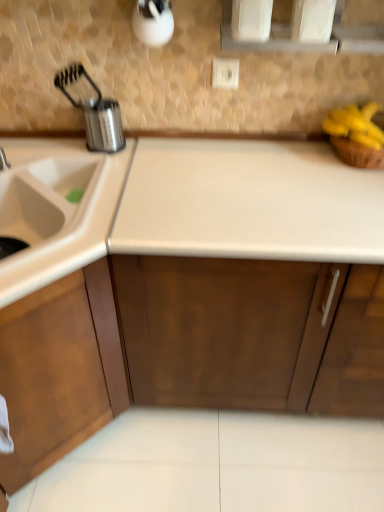
Question: Is wooden cabinet at left not within brushed metal faucet at left?

Choices:
 (A) no
 (B) yes

Answer: (B)

Question: Can you confirm if wooden cabinet at left is wider than brushed metal faucet at left?

Choices:
 (A) no
 (B) yes

Answer: (B)

Question: Considering the relative positions of wooden cabinet at left and brushed metal faucet at left in the image provided, is wooden cabinet at left behind brushed metal faucet at left?

Choices:
 (A) yes
 (B) no

Answer: (B)

Question: Is wooden cabinet at left far from brushed metal faucet at left?

Choices:
 (A) no
 (B) yes

Answer: (A)

Question: Considering the relative sizes of wooden cabinet at left and brushed metal faucet at left in the image provided, is wooden cabinet at left thinner than brushed metal faucet at left?

Choices:
 (A) no
 (B) yes

Answer: (A)

Question: Do you think wooden cabinet at left is within white laminate countertop at center, or outside of it?

Choices:
 (A) inside
 (B) outside

Answer: (B)

Question: Visually, is wooden cabinet at left positioned to the left or to the right of white laminate countertop at center?

Choices:
 (A) right
 (B) left

Answer: (B)

Question: Considering the positions of wooden cabinet at left and white laminate countertop at center in the image, is wooden cabinet at left taller or shorter than white laminate countertop at center?

Choices:
 (A) tall
 (B) short

Answer: (B)

Question: Is point (26, 471) positioned closer to the camera than point (51, 362)?

Choices:
 (A) farther
 (B) closer

Answer: (A)

Question: Considering the positions of yellow matte bananas at upper right and white laminate countertop at center in the image, is yellow matte bananas at upper right bigger or smaller than white laminate countertop at center?

Choices:
 (A) big
 (B) small

Answer: (B)

Question: From a real-world perspective, relative to white laminate countertop at center, is yellow matte bananas at upper right vertically above or below?

Choices:
 (A) below
 (B) above

Answer: (B)

Question: Is yellow matte bananas at upper right taller or shorter than white laminate countertop at center?

Choices:
 (A) tall
 (B) short

Answer: (B)

Question: Is yellow matte bananas at upper right situated inside white laminate countertop at center or outside?

Choices:
 (A) inside
 (B) outside

Answer: (B)

Question: From a real-world perspective, is white laminate countertop at center physically located above or below wooden cabinet at left?

Choices:
 (A) below
 (B) above

Answer: (B)

Question: Relative to wooden cabinet at left, is white laminate countertop at center in front or behind?

Choices:
 (A) behind
 (B) front

Answer: (A)